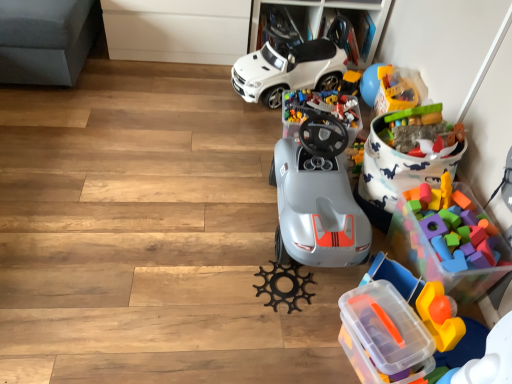
Question: Should I look upward or downward to see rubberized plastic toy at upper right, positioned as the first toy in top-to-bottom order?

Choices:
 (A) down
 (B) up

Answer: (B)

Question: Considering the relative sizes of gray plastic steering wheel at center, positioned as the 2th toy in top-to-bottom order, and black matte gear at center, the 2th toy in the bottom-to-top sequence, in the image provided, is gray plastic steering wheel at center, positioned as the 2th toy in top-to-bottom order, bigger than black matte gear at center, the 2th toy in the bottom-to-top sequence,?

Choices:
 (A) yes
 (B) no

Answer: (A)

Question: Is gray plastic steering wheel at center, positioned as the 2th toy in top-to-bottom order, to the left of black matte gear at center, the 2th toy in the bottom-to-top sequence, from the viewer's perspective?

Choices:
 (A) yes
 (B) no

Answer: (B)

Question: Is gray plastic steering wheel at center, the 5th toy when ordered from bottom to top, beside black matte gear at center, acting as the 5th toy starting from the top?

Choices:
 (A) yes
 (B) no

Answer: (B)

Question: Is gray plastic steering wheel at center, positioned as the 2th toy in top-to-bottom order, facing away from black matte gear at center, the 2th toy in the bottom-to-top sequence?

Choices:
 (A) yes
 (B) no

Answer: (B)

Question: From a real-world perspective, is gray plastic steering wheel at center, positioned as the 2th toy in top-to-bottom order, beneath black matte gear at center, acting as the 5th toy starting from the top?

Choices:
 (A) no
 (B) yes

Answer: (A)

Question: From the image's perspective, does gray plastic steering wheel at center, the 5th toy when ordered from bottom to top, appear higher than black matte gear at center, the 2th toy in the bottom-to-top sequence?

Choices:
 (A) yes
 (B) no

Answer: (A)

Question: Can you confirm if gray plastic steering wheel at center, positioned as the 2th toy in top-to-bottom order, is shorter than translucent plastic storage box at lower right?

Choices:
 (A) no
 (B) yes

Answer: (B)

Question: Does gray plastic steering wheel at center, the 5th toy when ordered from bottom to top, turn towards translucent plastic storage box at lower right?

Choices:
 (A) yes
 (B) no

Answer: (B)

Question: Is gray plastic steering wheel at center, the 5th toy when ordered from bottom to top, closer to camera compared to translucent plastic storage box at lower right?

Choices:
 (A) no
 (B) yes

Answer: (A)

Question: Is translucent plastic storage box at lower right completely or partially inside gray plastic steering wheel at center, positioned as the 2th toy in top-to-bottom order?

Choices:
 (A) yes
 (B) no

Answer: (B)

Question: Is gray plastic steering wheel at center, the 5th toy when ordered from bottom to top, further to the viewer compared to translucent plastic storage box at lower right?

Choices:
 (A) no
 (B) yes

Answer: (B)

Question: Is gray plastic steering wheel at center, the 5th toy when ordered from bottom to top, outside of translucent plastic storage box at lower right?

Choices:
 (A) yes
 (B) no

Answer: (A)

Question: Does black matte gear at center, acting as the 5th toy starting from the top, lie behind rubberized plastic toy at upper right, marked as the 3th toy in a top-to-bottom arrangement?

Choices:
 (A) yes
 (B) no

Answer: (B)